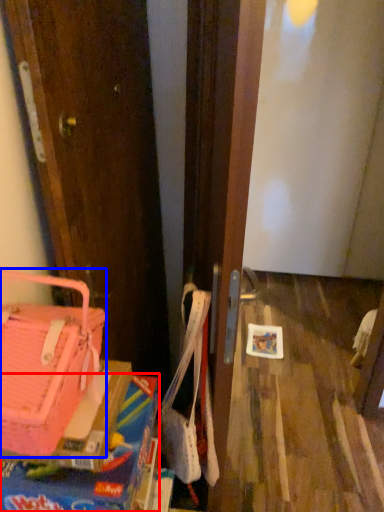
Question: Among these objects, which one is nearest to the camera, box (highlighted by a red box) or handbag (highlighted by a blue box)?

Choices:
 (A) box
 (B) handbag

Answer: (B)